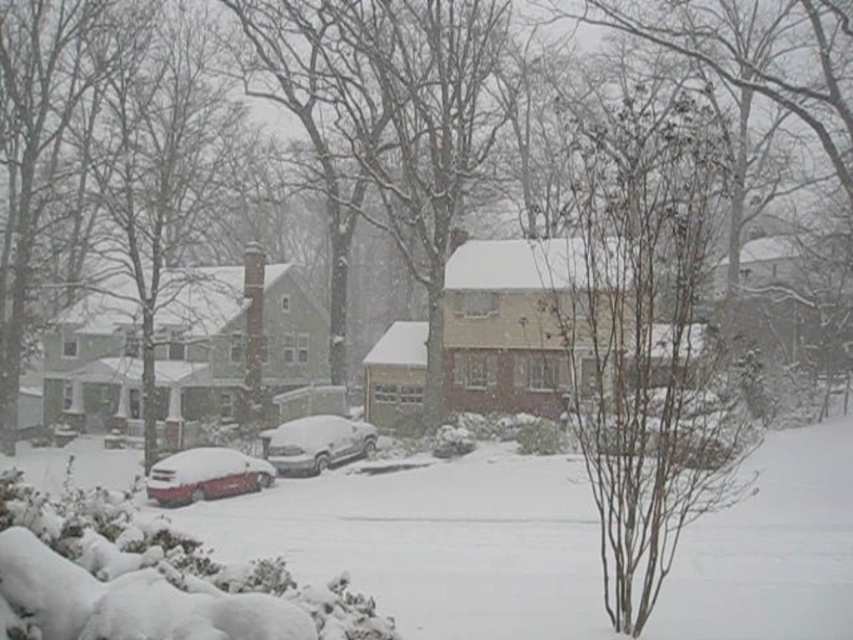
Who is more forward, (434, 554) or (708, 241)?

Positioned in front is point (708, 241).

Does white fluffy snow at center appear under bare branches at center?

Yes.

Who is more forward, (437,520) or (740,486)?

Point (437,520) is more forward.

Where is `white fluffy snow at center`? Image resolution: width=853 pixels, height=640 pixels. white fluffy snow at center is located at coordinates (434, 541).

Who is taller, bare branches at center or sleek metallic car at lower left?

With more height is bare branches at center.

Who is higher up, bare branches at center or sleek metallic car at lower left?

bare branches at center

Does point (618, 113) come farther from viewer compared to point (152, 470)?

Yes, it is behind point (152, 470).

Image resolution: width=853 pixels, height=640 pixels. In order to click on bare branches at center in this screenshot , I will do `click(648, 342)`.

Can you confirm if sleek metallic car at lower left is positioned below sleek silver sedan at center?

Correct, sleek metallic car at lower left is located below sleek silver sedan at center.

Which is behind, point (206, 465) or point (364, 445)?

The point (364, 445) is behind.

Identify the location of sleek metallic car at lower left. (206, 476).